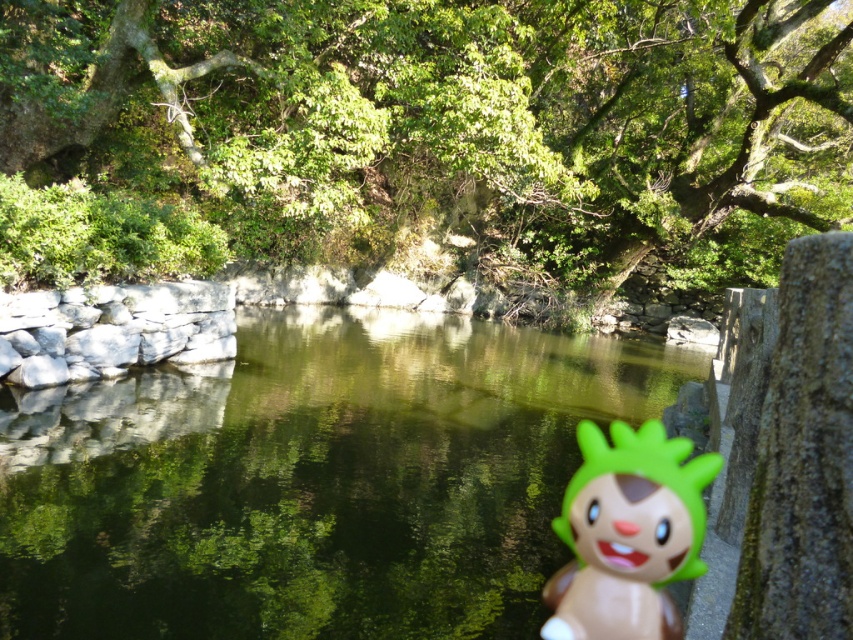
You are a bird flying over the serene natural setting. You see the green leafy tree at upper center and the green reflective water at center. Which object is positioned higher in the scene?

The green leafy tree at upper center is located above the green reflective water at center, so it is positioned higher in the scene.

You are standing at the center of the image and want to walk towards the green leafy tree at upper center. Which direction should you move in?

The green leafy tree at upper center is located at point (x=450, y=122), so you should move towards the upper center direction to reach it.